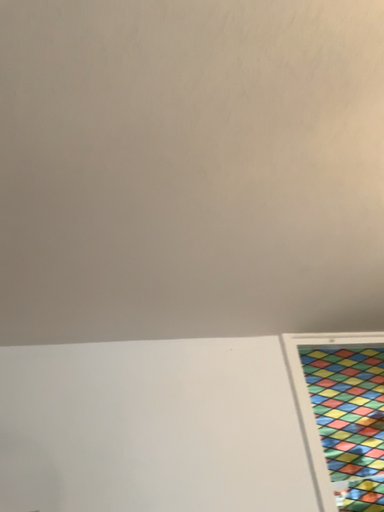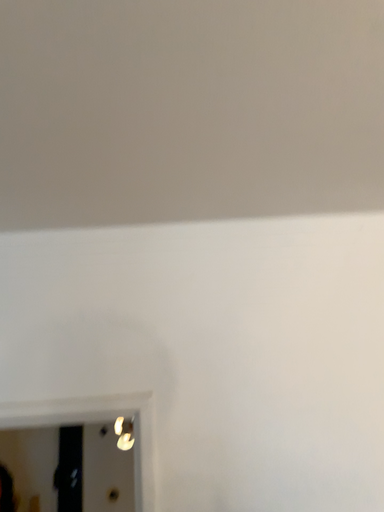
Question: How did the camera likely rotate when shooting the video?

Choices:
 (A) rotated downward
 (B) rotated upward

Answer: (A)